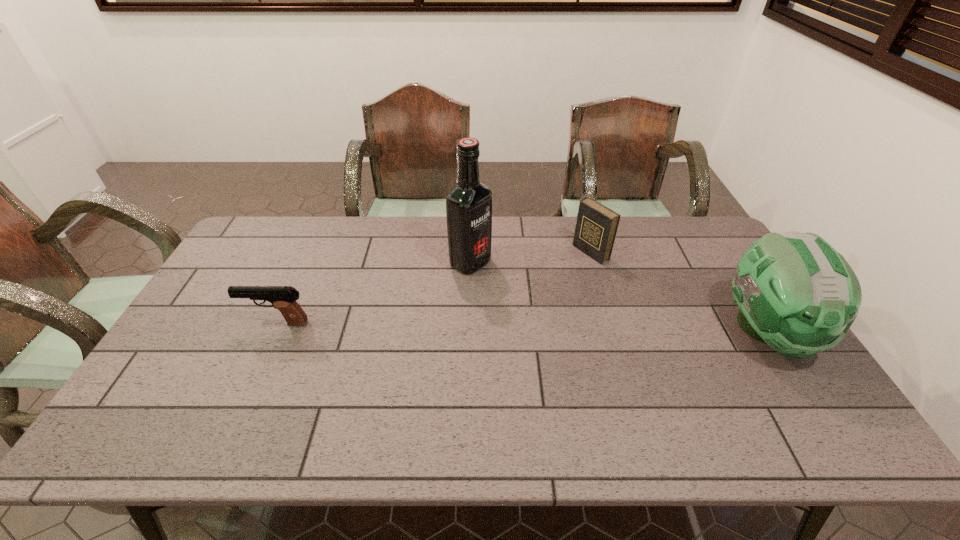
Identify the location of object at the right edge. This screenshot has height=540, width=960. (796, 293).

At what (x,y) coordinates should I click in order to perform the action: click on free region at the far edge of the desktop. Please return your answer as a coordinate pair (x, y). Looking at the image, I should click on (387, 243).

This screenshot has height=540, width=960. In the image, there is a desktop. Identify the location of vacant space at the near edge. point(469,392).

In the image, there is a desktop. Identify the location of vacant region at the left edge. This screenshot has width=960, height=540. (240, 273).

The height and width of the screenshot is (540, 960). I want to click on vacant area at the near left corner, so click(191, 409).

In the image, there is a desktop. At what (x,y) coordinates should I click in order to perform the action: click on free space at the near right corner. Please return your answer as a coordinate pair (x, y). Image resolution: width=960 pixels, height=540 pixels. Looking at the image, I should click on (759, 382).

I want to click on empty space between the pistol and the diary, so click(434, 288).

Find the location of a particular element. This screenshot has width=960, height=540. empty space that is in between the shortest object and the liquor is located at coordinates (373, 293).

You are a GUI agent. You are given a task and a screenshot of the screen. Output one action in this format:
    pyautogui.click(x=<x>, y=<y>)
    Task: Click on the free space between the tallest object and the second tallest object
    The image size is (960, 540).
    Given the screenshot: What is the action you would take?
    pyautogui.click(x=618, y=297)

Where is `vacant space that's between the pistol and the liquor`? vacant space that's between the pistol and the liquor is located at coordinates (373, 293).